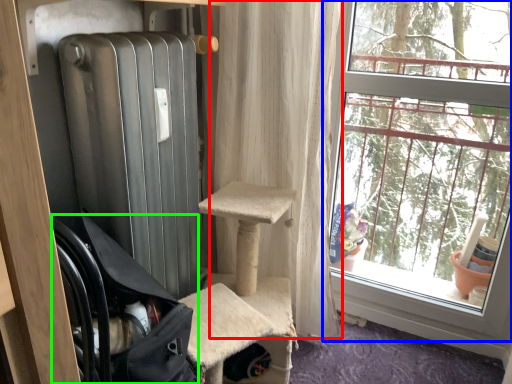
Question: Estimate the real-world distances between objects in this image. Which object is farther from curtain (highlighted by a red box), window (highlighted by a blue box) or chair (highlighted by a green box)?

Choices:
 (A) window
 (B) chair

Answer: (B)